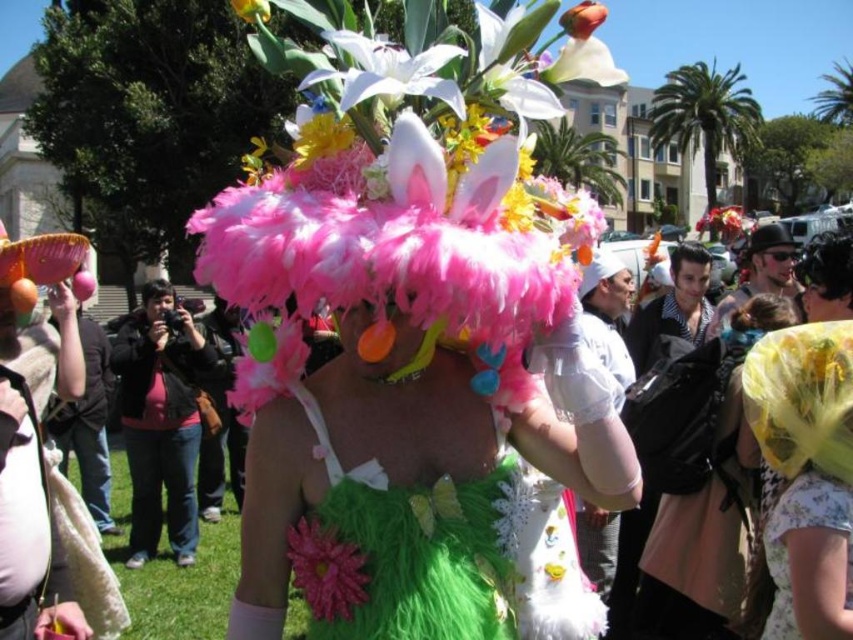
Does fluffy yellow hat at center have a smaller size compared to shiny black hair at center?

Yes, fluffy yellow hat at center is smaller than shiny black hair at center.

In the scene shown: Is fluffy yellow hat at center closer to camera compared to shiny black hair at center?

Yes, fluffy yellow hat at center is closer to the viewer.

Who is more forward, [840,412] or [845,296]?

Positioned in front is point [840,412].

The image size is (853, 640). I want to click on fluffy yellow hat at center, so click(x=805, y=474).

Which of these two, matte black hat at center or matte black hat at upper center, stands taller?

matte black hat at center is taller.

Who is more distant from viewer, (786, 280) or (772, 227)?

Positioned behind is point (772, 227).

Where is `matte black hat at center`? matte black hat at center is located at coordinates (761, 273).

Who is positioned more to the right, feathered pink hat at center or yellow fabric hat at center?

Positioned to the right is yellow fabric hat at center.

Between point (375, 307) and point (718, 432), which one is positioned in front?

Point (375, 307)

Identify the location of feathered pink hat at center. (407, 196).